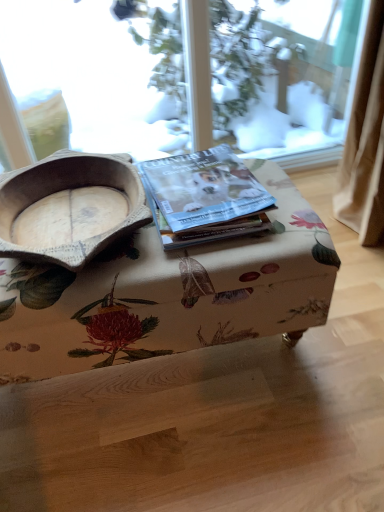
This screenshot has height=512, width=384. I want to click on free spot below wooden bowl at left (from a real-world perspective), so click(x=80, y=226).